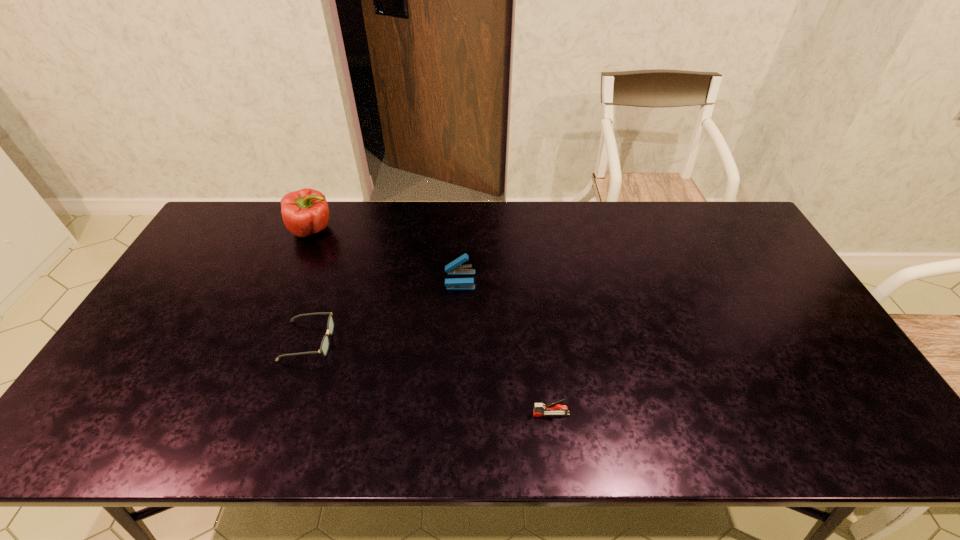
Where is `the farthest object`? The width and height of the screenshot is (960, 540). the farthest object is located at coordinates (304, 212).

You are a GUI agent. You are given a task and a screenshot of the screen. Output one action in this format:
    pyautogui.click(x=<x>, y=<y>)
    Task: Click on the tallest object
    Image resolution: width=960 pixels, height=540 pixels.
    Given the screenshot: What is the action you would take?
    (x=304, y=212)

Find the location of a particular element. This screenshot has width=960, height=540. the farther stapler is located at coordinates (454, 268).

Where is `the second farthest object`? the second farthest object is located at coordinates (454, 268).

This screenshot has height=540, width=960. I want to click on the rightmost object, so click(550, 409).

This screenshot has height=540, width=960. I want to click on the nearest object, so click(550, 409).

Where is `spectacles`? The image size is (960, 540). spectacles is located at coordinates (324, 347).

In order to click on the shortest object in this screenshot , I will do `click(324, 347)`.

The height and width of the screenshot is (540, 960). Identify the location of free spot located on the front of the tallest object. [281, 303].

Identify the location of blank space located on the right of the second farthest object. (583, 280).